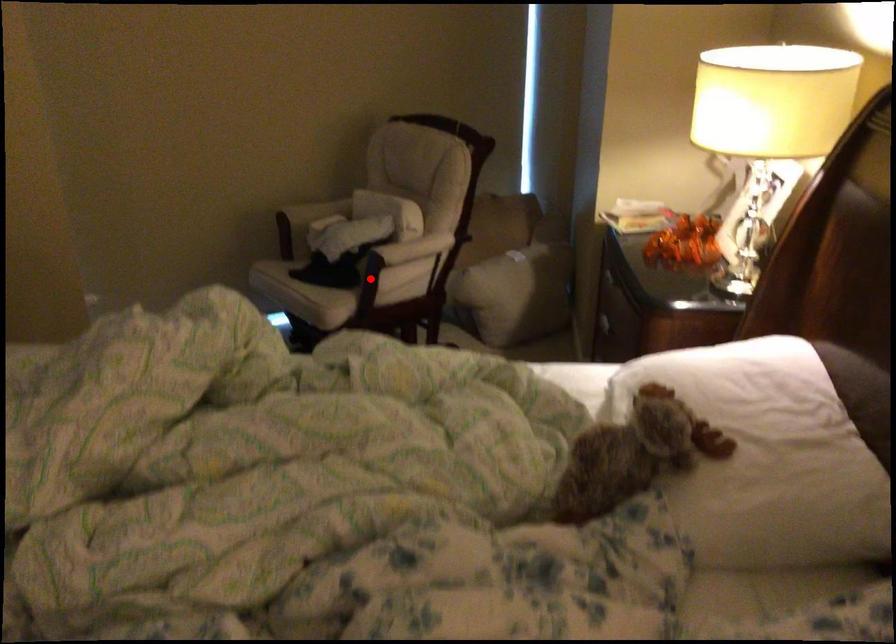
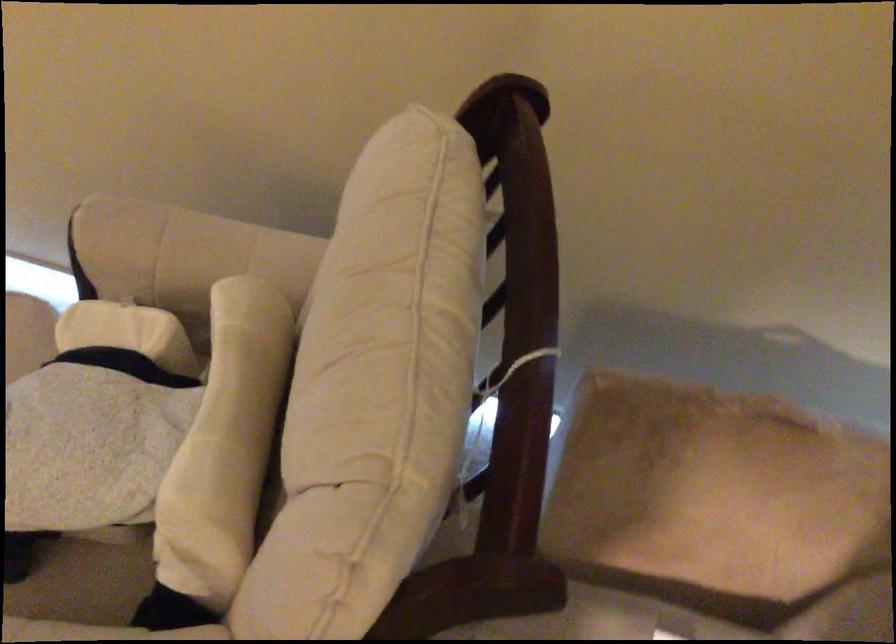
Where in the second image is the point corresponding to the highlighted location from the first image?

(82, 583)